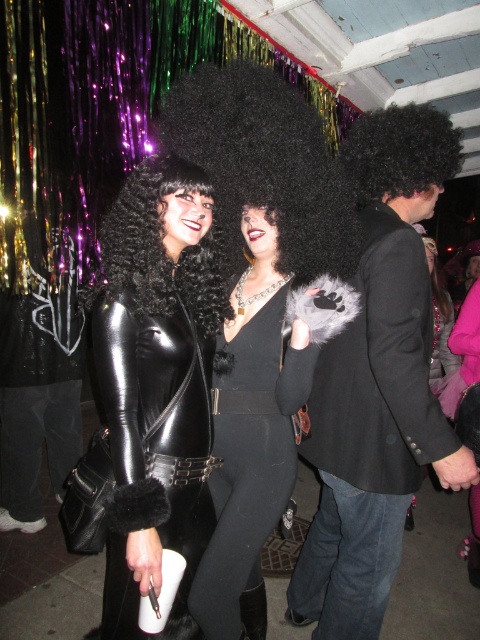
Question: Observing the image, what is the correct spatial positioning of black curly wig at center in reference to black curly hair at upper right?

Choices:
 (A) above
 (B) below

Answer: (B)

Question: Is black furry coat at right in front of black curly wig at upper center?

Choices:
 (A) no
 (B) yes

Answer: (B)

Question: Which point is farther to the camera?

Choices:
 (A) black curly hair at upper right
 (B) black leather jacket at center
 (C) black curly wig at center

Answer: (A)

Question: From the image, what is the correct spatial relationship of black leather jacket at center in relation to black curly hair at upper right?

Choices:
 (A) left
 (B) right

Answer: (A)

Question: Estimate the real-world distances between objects in this image. Which object is farther from the black curly wig at upper center?

Choices:
 (A) black curly wig at center
 (B) black leather jacket at center
 (C) black furry coat at right
 (D) black velvet dress at center

Answer: (B)

Question: Which point is farther to the camera?

Choices:
 (A) black curly hair at upper right
 (B) black velvet dress at center
 (C) black curly wig at center
 (D) black furry coat at right

Answer: (A)